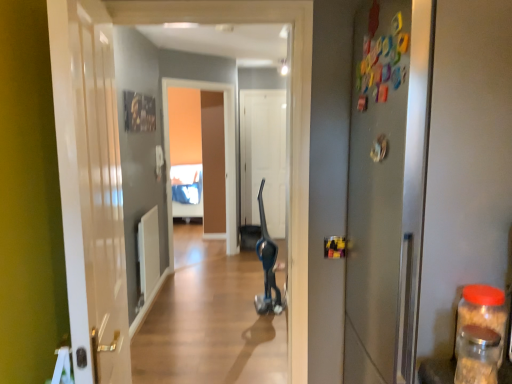
Question: Is white matte door at center, marked as the first door in a back-to-front arrangement, bigger than white glossy door at left, which is the first door in left-to-right order?

Choices:
 (A) yes
 (B) no

Answer: (B)

Question: From the image's perspective, is white matte door at center, marked as the first door in a back-to-front arrangement, on white glossy door at left, which ranks as the third door in right-to-left order?

Choices:
 (A) no
 (B) yes

Answer: (B)

Question: From the image's perspective, is white matte door at center, arranged as the second door when viewed from the right, under white glossy door at left, which ranks as the third door in right-to-left order?

Choices:
 (A) yes
 (B) no

Answer: (B)

Question: From a real-world perspective, is white matte door at center, which ranks as the third door in front-to-back order, located beneath white glossy door at left, which is the first door in left-to-right order?

Choices:
 (A) no
 (B) yes

Answer: (B)

Question: From a real-world perspective, is white matte door at center, acting as the second door starting from the left, positioned over white glossy door at left, which is the first door in left-to-right order, based on gravity?

Choices:
 (A) no
 (B) yes

Answer: (A)

Question: Are white matte door at center, marked as the first door in a back-to-front arrangement, and white glossy door at left, which ranks as the first door in front-to-back order, far apart?

Choices:
 (A) no
 (B) yes

Answer: (B)

Question: From the image's perspective, would you say transparent plastic jar at right, acting as the first bottle starting from the back, is positioned over white glossy door at left, which is the first door in left-to-right order?

Choices:
 (A) yes
 (B) no

Answer: (B)

Question: Is transparent plastic jar at right, which appears as the 2th bottle when viewed from the front, not close to white glossy door at left, which ranks as the first door in front-to-back order?

Choices:
 (A) no
 (B) yes

Answer: (B)

Question: Can you confirm if transparent plastic jar at right, acting as the first bottle starting from the back, is bigger than white glossy door at left, which ranks as the third door in right-to-left order?

Choices:
 (A) yes
 (B) no

Answer: (B)

Question: Can you confirm if transparent plastic jar at right, acting as the first bottle starting from the back, is smaller than white glossy door at left, which ranks as the first door in front-to-back order?

Choices:
 (A) no
 (B) yes

Answer: (B)

Question: Considering the relative positions of transparent plastic jar at right, acting as the first bottle starting from the back, and white glossy door at left, which ranks as the third door in right-to-left order, in the image provided, is transparent plastic jar at right, acting as the first bottle starting from the back, to the left of white glossy door at left, which ranks as the third door in right-to-left order, from the viewer's perspective?

Choices:
 (A) yes
 (B) no

Answer: (B)

Question: Is the position of transparent plastic jar at right, which appears as the 2th bottle when viewed from the front, less distant than that of white glossy door at left, placed as the third door when sorted from back to front?

Choices:
 (A) yes
 (B) no

Answer: (B)

Question: Is transparent glass jar at right, the 2th bottle in the back-to-front sequence, turned away from white matte door at center, marked as the first door in a back-to-front arrangement?

Choices:
 (A) no
 (B) yes

Answer: (A)